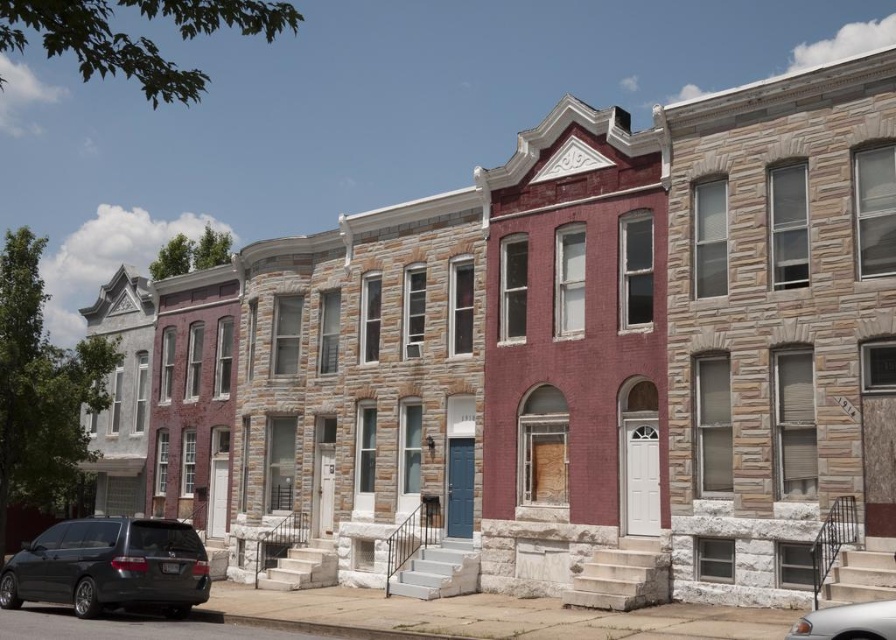
Between matte black minivan at lower left and silver metallic car at lower right, which one is positioned higher?

silver metallic car at lower right is above.

Identify the location of matte black minivan at lower left. Image resolution: width=896 pixels, height=640 pixels. (110, 566).

Where is `matte black minivan at lower left`? The width and height of the screenshot is (896, 640). matte black minivan at lower left is located at coordinates (110, 566).